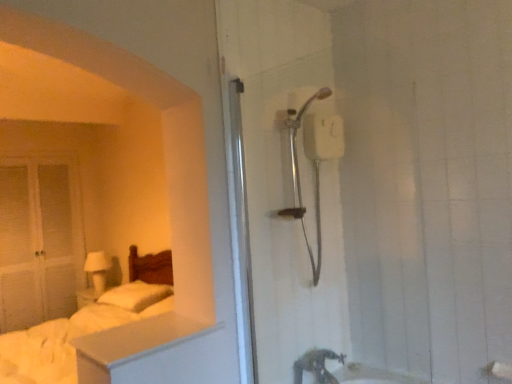
The image size is (512, 384). In order to click on free spot above white matte dresser at lower left (from a real-world perspective) in this screenshot , I will do `click(142, 325)`.